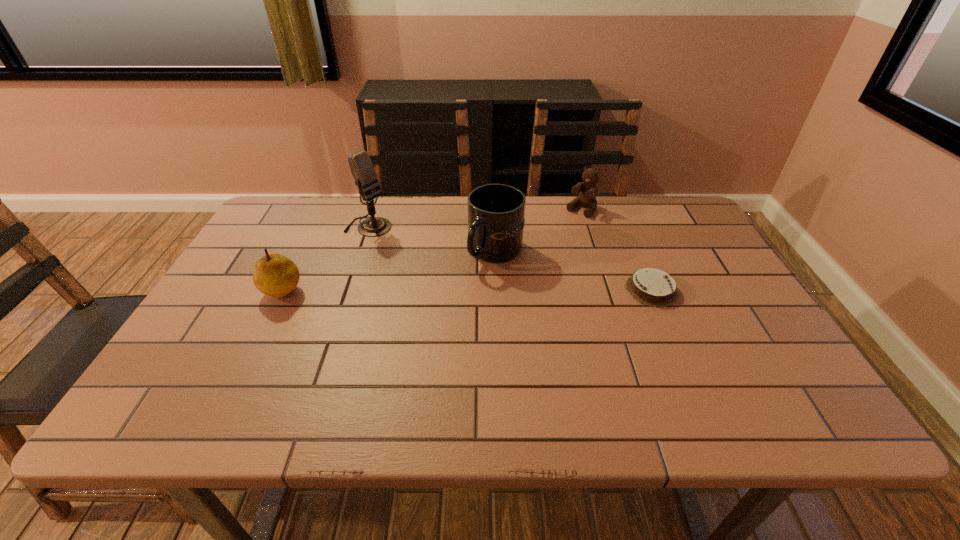
At what (x,y) coordinates should I click in order to perform the action: click on free space between the fourth shortest object and the shortest object. Please return your answer as a coordinate pair (x, y). This screenshot has height=540, width=960. Looking at the image, I should click on (573, 271).

Find the location of a particular element. The image size is (960, 540). vacant space that is in between the teddy bear and the chocolate cake is located at coordinates (616, 249).

Locate an element on the screen. vacant area that lies between the teddy bear and the chocolate cake is located at coordinates (616, 249).

At what (x,y) coordinates should I click in order to perform the action: click on free space between the pear and the microphone. Please return your answer as a coordinate pair (x, y). Looking at the image, I should click on (326, 257).

Point out which object is positioned as the third nearest to the second tallest object. Please provide its 2D coordinates. Your answer should be formatted as a tuple, i.e. [(x, y)], where the tuple contains the x and y coordinates of a point satisfying the conditions above.

[(652, 287)]

Locate which object is the fourth closest to the microphone. Please provide its 2D coordinates. Your answer should be formatted as a tuple, i.e. [(x, y)], where the tuple contains the x and y coordinates of a point satisfying the conditions above.

[(652, 287)]

Image resolution: width=960 pixels, height=540 pixels. I want to click on free spot that satisfies the following two spatial constraints: 1. on the front side of the teddy bear; 2. on the left side of the shortest object, so click(x=607, y=289).

At what (x,y) coordinates should I click in order to perform the action: click on vacant region that satisfies the following two spatial constraints: 1. on the front side of the tallest object; 2. on the right side of the chocolate cake. Please return your answer as a coordinate pair (x, y). This screenshot has width=960, height=540. Looking at the image, I should click on (348, 289).

Find the location of a particular element. The width and height of the screenshot is (960, 540). free space in the image that satisfies the following two spatial constraints: 1. on the back side of the leftmost object; 2. on the right side of the fourth object from right to left is located at coordinates (313, 227).